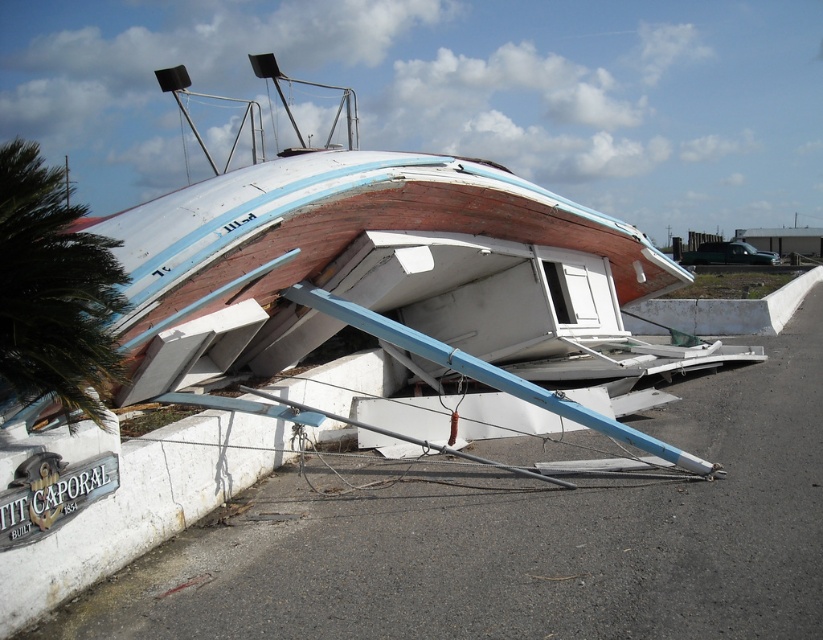
Question: Among these objects, which one is nearest to the camera?

Choices:
 (A) wooden boat at center
 (B) green leafy palm tree at left

Answer: (B)

Question: Can you confirm if wooden boat at center is smaller than green leafy palm tree at left?

Choices:
 (A) no
 (B) yes

Answer: (A)

Question: Is wooden boat at center to the left of green leafy palm tree at left from the viewer's perspective?

Choices:
 (A) yes
 (B) no

Answer: (A)

Question: Does wooden boat at center have a lesser width compared to green leafy palm tree at left?

Choices:
 (A) yes
 (B) no

Answer: (B)

Question: Which point is closer to the camera?

Choices:
 (A) wooden boat at center
 (B) green leafy palm tree at left

Answer: (B)